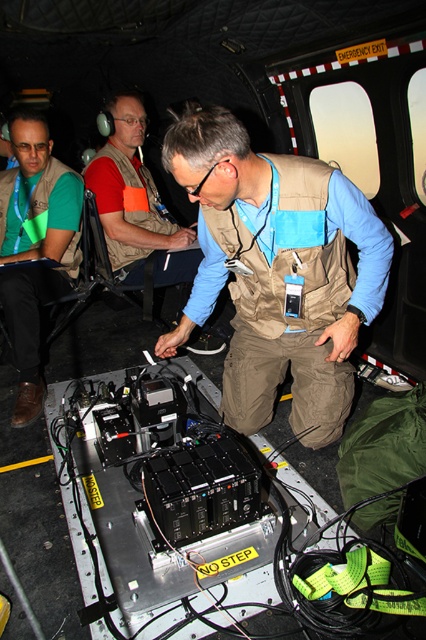
Who is positioned more to the left, matte green vest at lower left or matte brown vest at center?

matte green vest at lower left

Between matte green vest at lower left and matte brown vest at center, which one appears on the right side from the viewer's perspective?

matte brown vest at center is more to the right.

Is point (25, 320) farther from viewer compared to point (112, 97)?

No, it is in front of (112, 97).

Find the location of a particular element. The image size is (426, 640). matte green vest at lower left is located at coordinates (34, 244).

Who is lower down, tan fabric vest at center or matte brown vest at center?

Positioned lower is tan fabric vest at center.

Does tan fabric vest at center have a lesser height compared to matte brown vest at center?

No, tan fabric vest at center is not shorter than matte brown vest at center.

Identify the location of tan fabric vest at center. The width and height of the screenshot is (426, 640). (278, 272).

Does tan fabric vest at center have a greater height compared to matte green vest at lower left?

In fact, tan fabric vest at center may be shorter than matte green vest at lower left.

Does tan fabric vest at center lie behind matte green vest at lower left?

That is False.

Does point (249, 205) lie in front of point (39, 196)?

Yes.

Where is `tan fabric vest at center`? This screenshot has height=640, width=426. tan fabric vest at center is located at coordinates (278, 272).